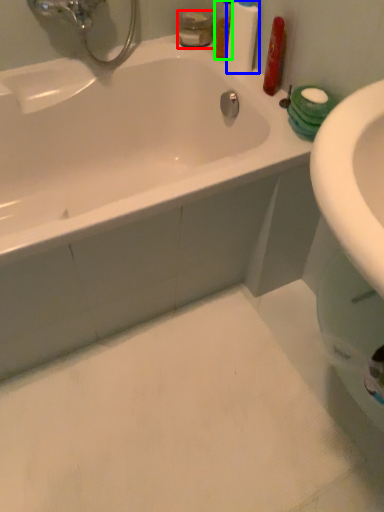
Question: Considering the real-world distances, which object is closest to mouthwash (highlighted by a red box)? cleaning product (highlighted by a blue box) or mouthwash (highlighted by a green box).

Choices:
 (A) cleaning product
 (B) mouthwash

Answer: (B)